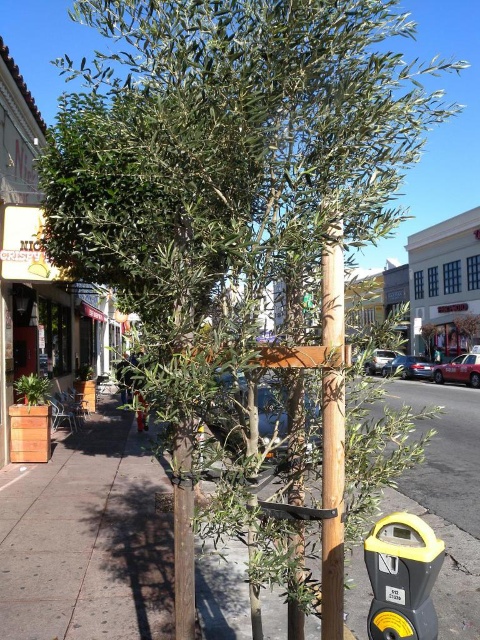
You are a delivery person trying to park your bike between the brown wooden pole at center and the yellow plastic parking meter at lower right. Is there enough space between them for your bike?

The brown wooden pole at center is positioned under the yellow plastic parking meter at lower right, meaning they are vertically aligned rather than horizontally spaced apart. Therefore, there is no horizontal space between them for the bike to be parked.

You are a delivery person trying to park your bike between the brown wooden pole at center and the yellow plastic parking meter at lower right. Can your bike fit if the bike is 1.2 meters wide?

The brown wooden pole at center is wider than the yellow plastic parking meter at lower right. However, since the exact width of the pole isn not provided, we can only compare their widths but cannot determine if the bike will fit. Please provide more information about the pole and meter widths.